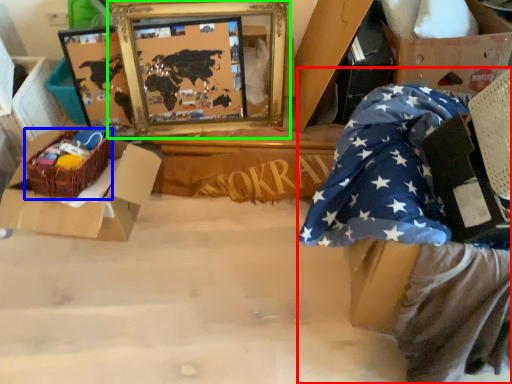
Question: Which is nearer to the person (highlighted by a red box)? crate (highlighted by a blue box) or picture frame (highlighted by a green box).

Choices:
 (A) crate
 (B) picture frame

Answer: (A)